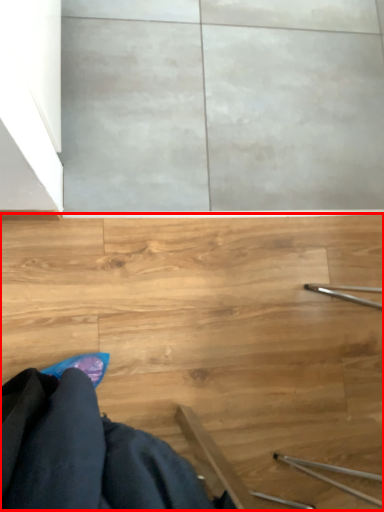
Question: From the image, what is the correct spatial relationship of stairs (annotated by the red box) in relation to robe?

Choices:
 (A) left
 (B) right

Answer: (B)